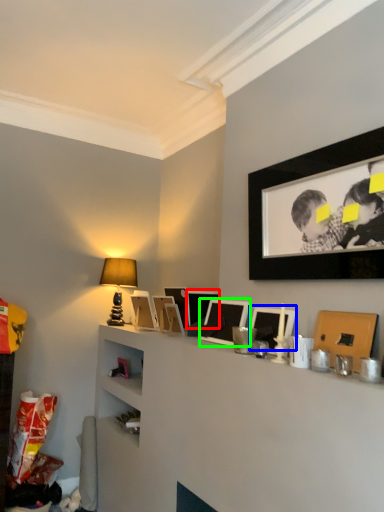
Question: Estimate the real-world distances between objects in this image. Which object is closer to picture frame (highlighted by a red box), picture frame (highlighted by a blue box) or picture frame (highlighted by a green box)?

Choices:
 (A) picture frame
 (B) picture frame

Answer: (B)